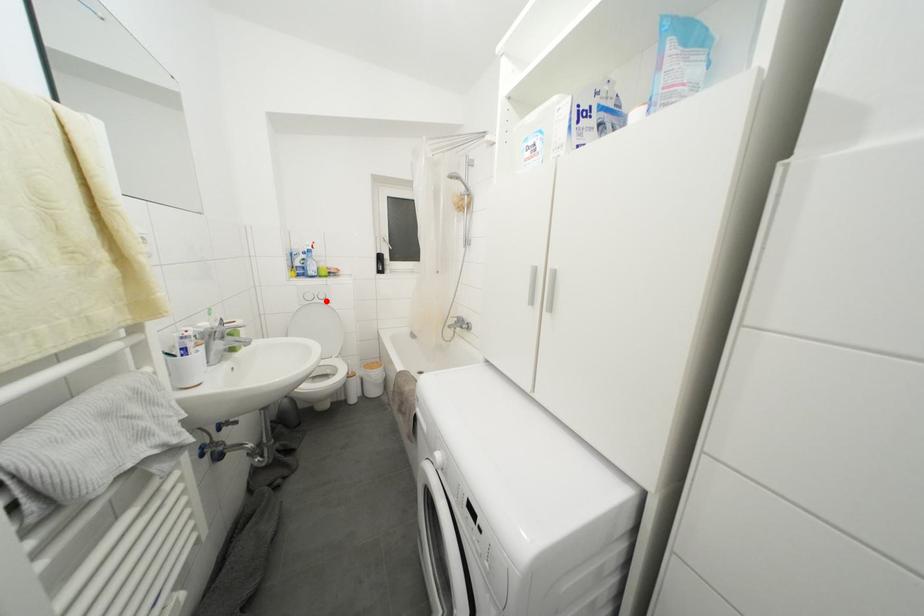
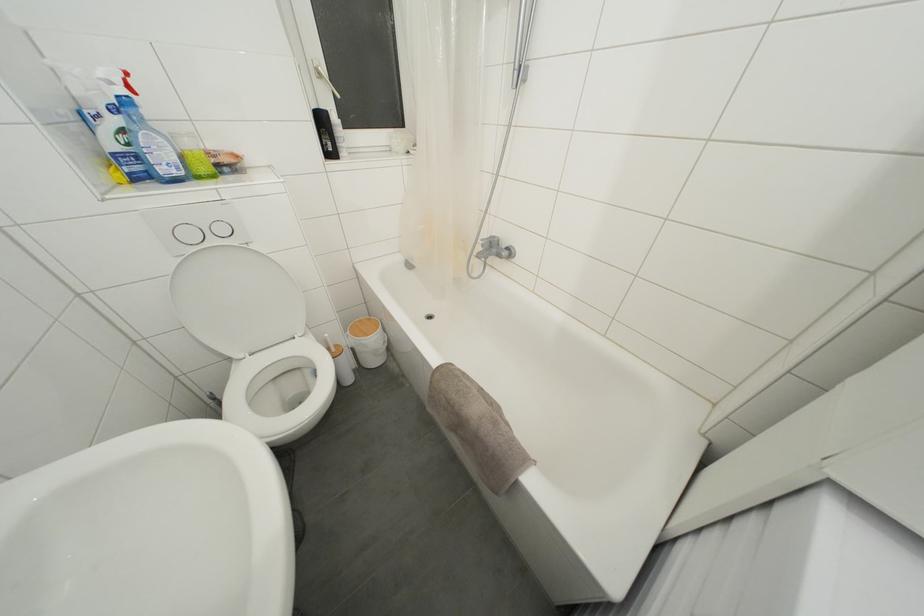
Locate, in the second image, the point that corresponds to the highlighted location in the first image.

(226, 235)